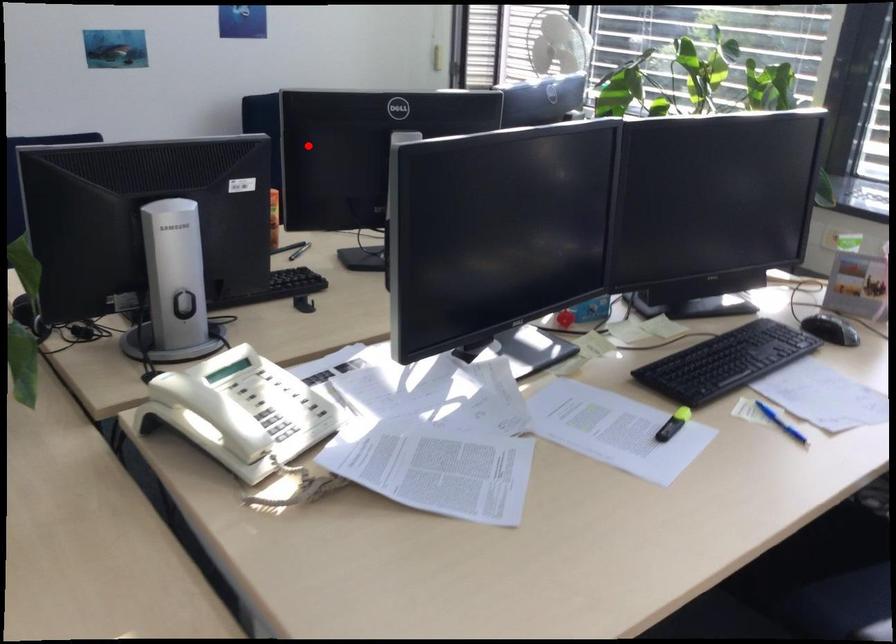
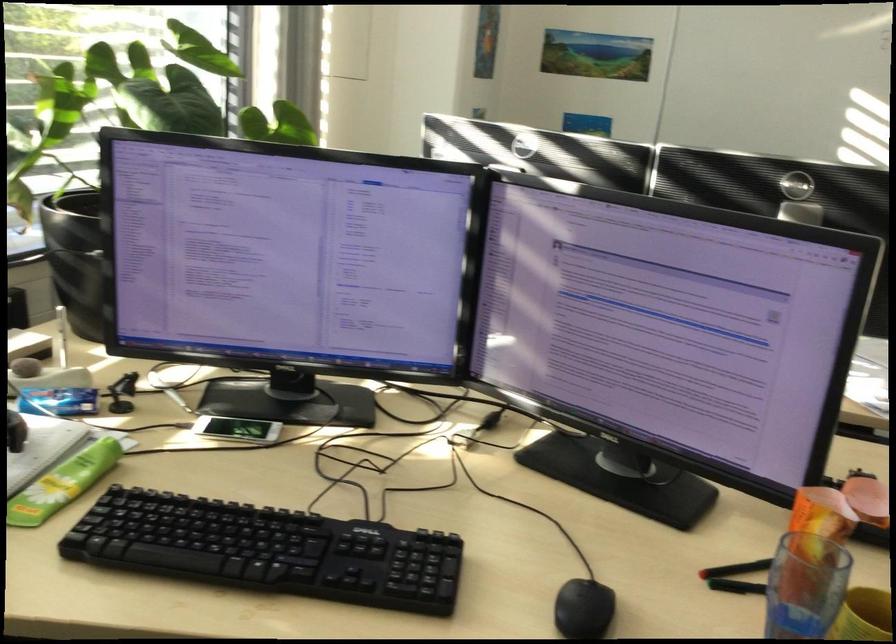
Question: I am providing you with two images of the same scene from different viewpoints. Given a red point in image1, look at the same physical point in image2. Is it:

Choices:
 (A) Closer to the viewpoint
 (B) Farther from the viewpoint

Answer: (A)